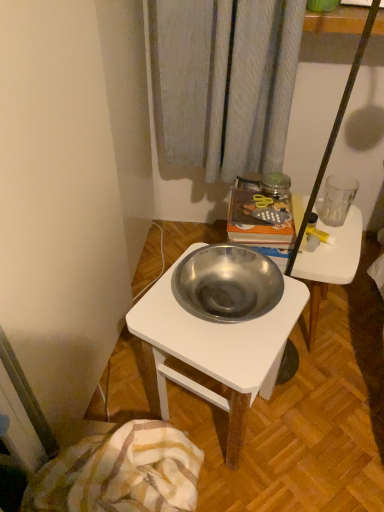
Describe the element at coordinates (217, 349) in the screenshot. I see `metallic white desk at center` at that location.

Describe the element at coordinates (331, 262) in the screenshot. Image resolution: width=384 pixels, height=512 pixels. I see `metallic silver bowl at center` at that location.

This screenshot has width=384, height=512. Describe the element at coordinates (337, 199) in the screenshot. I see `transparent glass at right` at that location.

The width and height of the screenshot is (384, 512). Identify the location of metallic white desk at center. (217, 349).

Is transparent glass at right bigger or smaller than plaid cotton blanket at lower left?

Considering their sizes, transparent glass at right takes up less space than plaid cotton blanket at lower left.

Which point is more distant from viewer, (344, 206) or (112, 457)?

The point (344, 206) is behind.

Consider the image. Would you say transparent glass at right is inside or outside plaid cotton blanket at lower left?

transparent glass at right is spatially situated outside plaid cotton blanket at lower left.

From a real-world perspective, is transparent glass at right physically below plaid cotton blanket at lower left?

Actually, transparent glass at right is physically above plaid cotton blanket at lower left in the real world.

Based on their positions, is metallic white desk at center located to the left or right of metallic silver bowl at center?

From the image, it's evident that metallic white desk at center is to the left of metallic silver bowl at center.

Looking at this image, from a real-world perspective, is metallic white desk at center located higher than metallic silver bowl at center?

Yes, from a real-world perspective, metallic white desk at center is on top of metallic silver bowl at center.

Who is shorter, metallic white desk at center or metallic silver bowl at center?

With less height is metallic silver bowl at center.

From the image's perspective, is metallic white desk at center over metallic silver bowl at center?

Actually, metallic white desk at center appears below metallic silver bowl at center in the image.

Is plaid cotton blanket at lower left directly adjacent to transparent glass at right?

No, plaid cotton blanket at lower left is not beside transparent glass at right.

Does plaid cotton blanket at lower left have a lesser width compared to transparent glass at right?

In fact, plaid cotton blanket at lower left might be wider than transparent glass at right.

Which object is closer to the camera taking this photo, plaid cotton blanket at lower left or transparent glass at right?

plaid cotton blanket at lower left is closer to the camera.

Is plaid cotton blanket at lower left facing towards transparent glass at right?

No, plaid cotton blanket at lower left does not turn towards transparent glass at right.

Does point (338, 194) lie behind point (193, 342)?

Yes, point (338, 194) is farther from viewer.

From the picture: Between transparent glass at right and metallic white desk at center, which one has more height?

metallic white desk at center.

Would you say transparent glass at right is to the left or to the right of metallic white desk at center in the picture?

In the image, transparent glass at right appears on the right side of metallic white desk at center.

Could you tell me if transparent glass at right is facing metallic white desk at center?

No, transparent glass at right is not turned towards metallic white desk at center.

Locate an element on the screen. table above the plaid cotton blanket at lower left (from the image's perspective) is located at coordinates (331, 262).

From the image's perspective, is metallic silver bowl at center under plaid cotton blanket at lower left?

Incorrect, from the image's perspective, metallic silver bowl at center is higher than plaid cotton blanket at lower left.

Based on the photo, which is less distant, (323, 229) or (99, 499)?

Point (99, 499)

Is metallic silver bowl at center facing towards plaid cotton blanket at lower left?

No, metallic silver bowl at center is not facing towards plaid cotton blanket at lower left.

Between plaid cotton blanket at lower left and metallic white desk at center, which one has more height?

Standing taller between the two is metallic white desk at center.

From a real-world perspective, is plaid cotton blanket at lower left beneath metallic white desk at center?

No, from a real-world perspective, plaid cotton blanket at lower left is not under metallic white desk at center.

Measure the distance between plaid cotton blanket at lower left and metallic white desk at center.

plaid cotton blanket at lower left and metallic white desk at center are 9.34 inches apart from each other.

Between plaid cotton blanket at lower left and metallic white desk at center, which one has larger width?

plaid cotton blanket at lower left is wider.

Where is `table on the right of plaid cotton blanket at lower left`? This screenshot has height=512, width=384. table on the right of plaid cotton blanket at lower left is located at coordinates (331, 262).

Considering the positions of points (93, 470) and (317, 270), is point (93, 470) closer to camera compared to point (317, 270)?

Yes, it is.

From a real-world perspective, is plaid cotton blanket at lower left on top of metallic silver bowl at center?

Yes, from a real-world perspective, plaid cotton blanket at lower left is above metallic silver bowl at center.

From the image's perspective, is plaid cotton blanket at lower left beneath metallic silver bowl at center?

Yes, from the image's perspective, plaid cotton blanket at lower left is beneath metallic silver bowl at center.

This screenshot has width=384, height=512. I want to click on blanket on the left of transparent glass at right, so click(x=120, y=473).

At what (x,y) coordinates should I click in order to perform the action: click on table behind the metallic white desk at center. Please return your answer as a coordinate pair (x, y). The image size is (384, 512). Looking at the image, I should click on (331, 262).

From the image, which object appears to be nearer to plaid cotton blanket at lower left, metallic silver bowl at center or metallic white desk at center?

metallic white desk at center.

Based on their spatial positions, is plaid cotton blanket at lower left or metallic silver bowl at center further from transparent glass at right?

plaid cotton blanket at lower left lies further to transparent glass at right than the other object.

Which object lies nearer to the anchor point transparent glass at right, plaid cotton blanket at lower left or metallic white desk at center?

metallic white desk at center lies closer to transparent glass at right than the other object.

When comparing their distances from metallic silver bowl at center, does plaid cotton blanket at lower left or metallic white desk at center seem further?

The object further to metallic silver bowl at center is plaid cotton blanket at lower left.

Considering their positions, is metallic silver bowl at center positioned closer to transparent glass at right than plaid cotton blanket at lower left?

metallic silver bowl at center is closer to transparent glass at right.

Based on their spatial positions, is transparent glass at right or metallic white desk at center further from plaid cotton blanket at lower left?

transparent glass at right is positioned further to the anchor plaid cotton blanket at lower left.

Looking at the image, which one is located closer to metallic white desk at center, metallic silver bowl at center or plaid cotton blanket at lower left?

plaid cotton blanket at lower left is closer to metallic white desk at center.

From the image, which object appears to be farther from metallic white desk at center, transparent glass at right or plaid cotton blanket at lower left?

Based on the image, transparent glass at right appears to be further to metallic white desk at center.

Identify the location of desk between transparent glass at right and plaid cotton blanket at lower left from top to bottom. The width and height of the screenshot is (384, 512). (217, 349).

I want to click on table between metallic white desk at center and transparent glass at right along the z-axis, so click(331, 262).

Locate an element on the screen. Image resolution: width=384 pixels, height=512 pixels. table located between plaid cotton blanket at lower left and transparent glass at right in the left-right direction is located at coordinates (331, 262).

Where is `desk between plaid cotton blanket at lower left and metallic silver bowl at center from left to right`? The height and width of the screenshot is (512, 384). desk between plaid cotton blanket at lower left and metallic silver bowl at center from left to right is located at coordinates (217, 349).